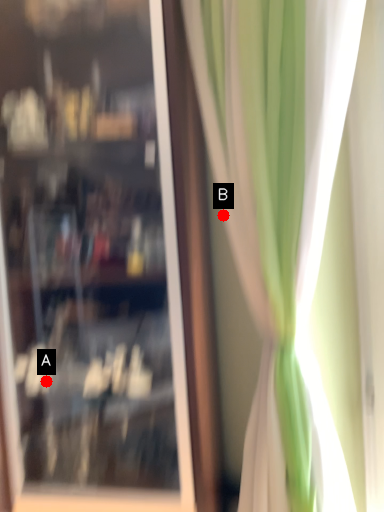
Question: Two points are circled on the image, labeled by A and B beside each circle. Among these points, which one is farthest from the camera?

Choices:
 (A) A is further
 (B) B is further

Answer: (B)